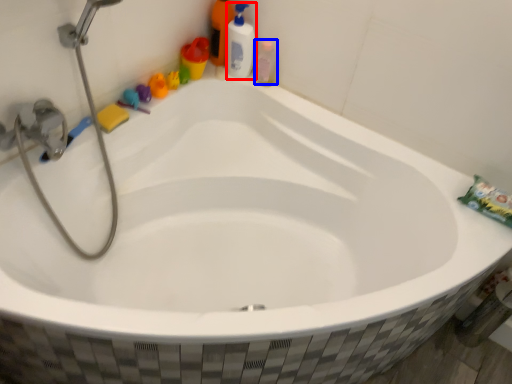
Question: Which object appears farthest to the camera in this image, cleaning product (highlighted by a red box) or mouthwash (highlighted by a blue box)?

Choices:
 (A) cleaning product
 (B) mouthwash

Answer: (B)